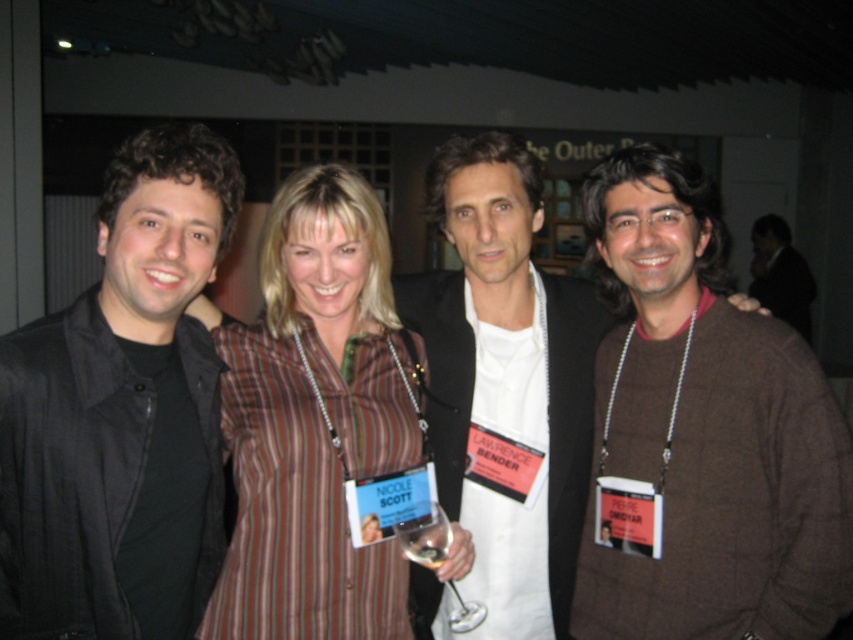
Question: Based on their relative distances, which object is farther from the brown wool sweater at right?

Choices:
 (A) black matte jacket at left
 (B) white matte shirt at center
 (C) transparent glass at center
 (D) brown textured sweater at center

Answer: (A)

Question: Can you confirm if black matte jacket at left is positioned to the left of transparent glass at center?

Choices:
 (A) no
 (B) yes

Answer: (B)

Question: Does brown textured sweater at center lie in front of transparent glass at center?

Choices:
 (A) yes
 (B) no

Answer: (A)

Question: Is black matte jacket at left to the left of white matte shirt at center from the viewer's perspective?

Choices:
 (A) no
 (B) yes

Answer: (B)

Question: Based on their relative distances, which object is nearer to the brown wool sweater at right?

Choices:
 (A) clear glass wine glass at center
 (B) white matte shirt at center
 (C) transparent glass at center
 (D) black matte jacket at left

Answer: (B)

Question: Which of the following is the closest to the observer?

Choices:
 (A) clear glass wine glass at center
 (B) black matte jacket at left

Answer: (B)